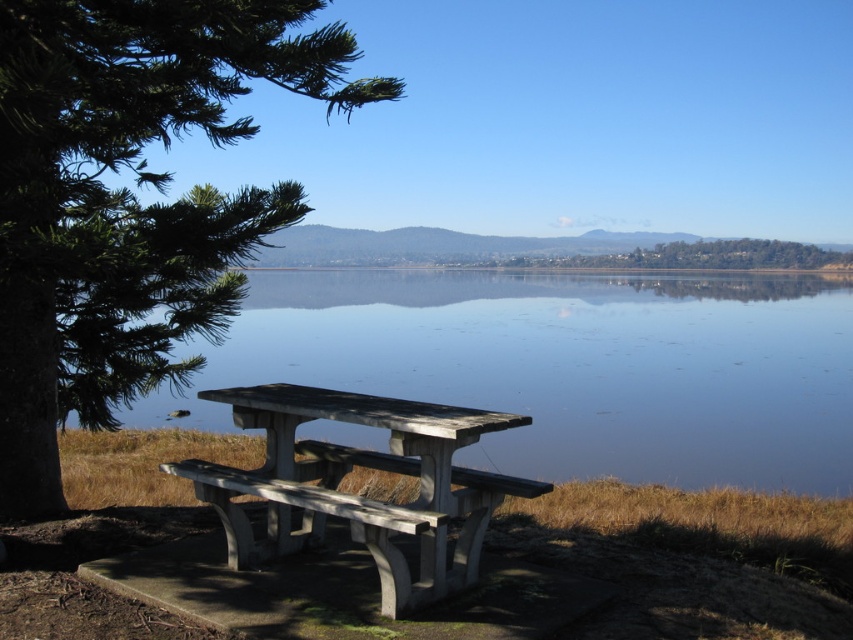
Question: Which object appears closest to the camera in this image?

Choices:
 (A) green textured tree at left
 (B) gray concrete picnic table at lower left

Answer: (B)

Question: Which point is closer to the camera?

Choices:
 (A) green textured tree at left
 (B) gray concrete picnic table at lower left
 (C) smooth blue water at center

Answer: (B)

Question: Is smooth blue water at center smaller than gray concrete picnic table at lower left?

Choices:
 (A) no
 (B) yes

Answer: (A)

Question: Is smooth blue water at center thinner than green textured tree at left?

Choices:
 (A) no
 (B) yes

Answer: (A)

Question: Is smooth blue water at center below green textured tree at left?

Choices:
 (A) no
 (B) yes

Answer: (B)

Question: Which object is the closest to the green textured tree at left?

Choices:
 (A) gray concrete picnic table at lower left
 (B) smooth blue water at center

Answer: (A)